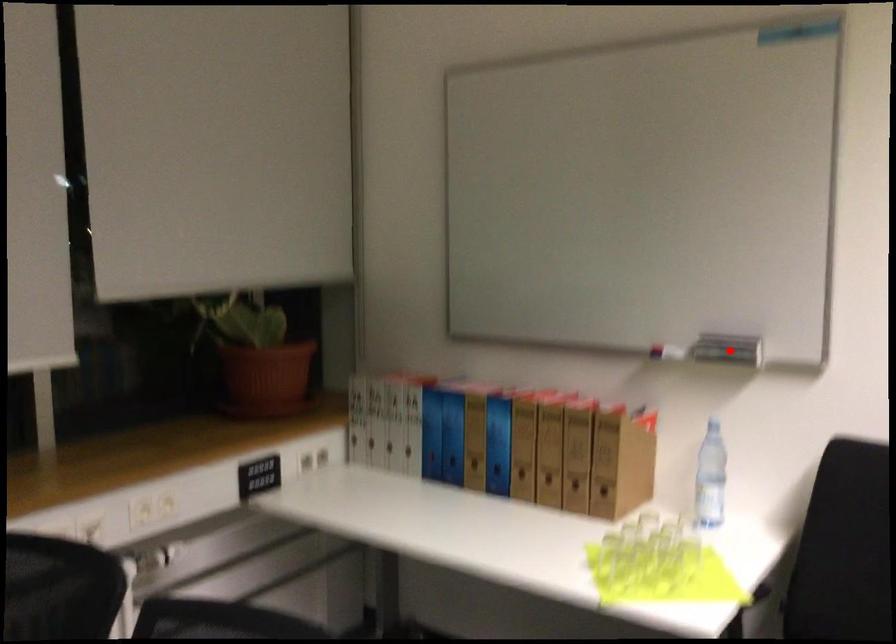
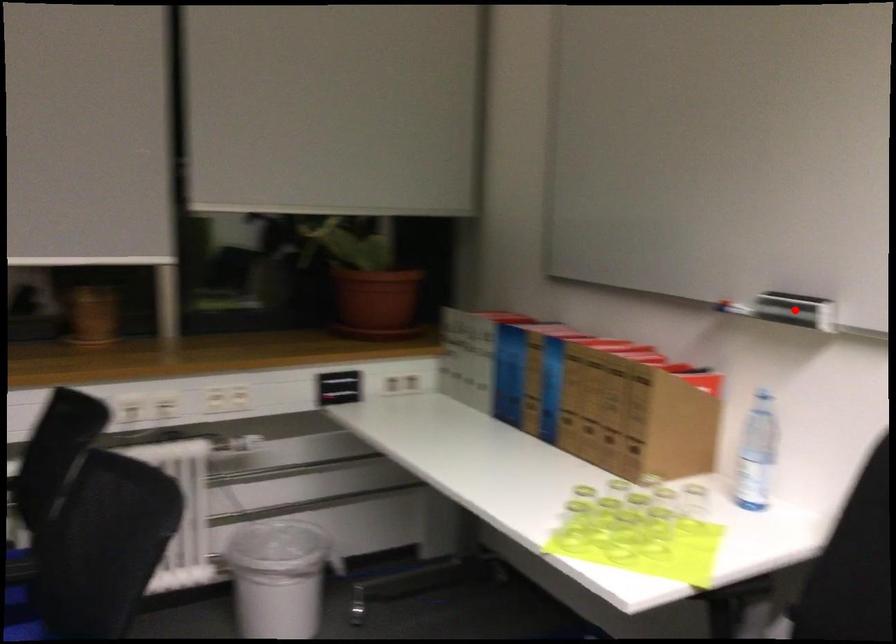
I am providing you with two images of the same scene from different viewpoints. A red point is marked on the first image and another point is marked on the second image. Is the marked point in image1 the same physical position as the marked point in image2?

Yes